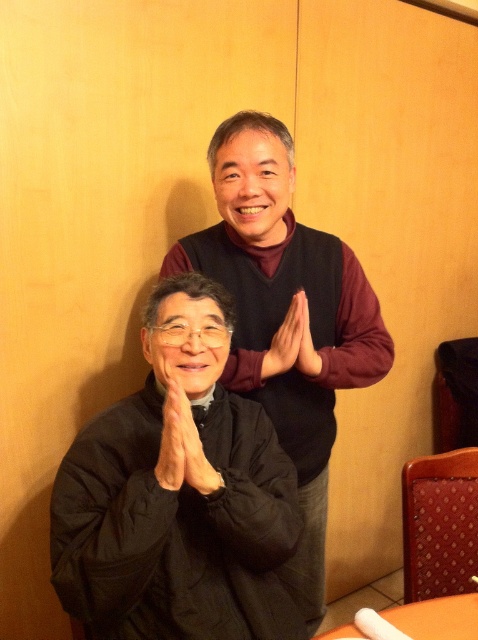
Question: Is black matte robe at lower left thinner than black matte jacket at center?

Choices:
 (A) yes
 (B) no

Answer: (A)

Question: Which object is positioned farthest from the matte black hands at center?

Choices:
 (A) orange plastic table at lower right
 (B) black matte jacket at center

Answer: (A)

Question: Is black matte jacket at center wider than orange plastic table at lower right?

Choices:
 (A) no
 (B) yes

Answer: (B)

Question: Which of these objects is positioned farthest from the black matte jacket at center?

Choices:
 (A) matte black hands at center
 (B) orange plastic table at lower right
 (C) black matte robe at lower left

Answer: (B)

Question: Which point is farther to the camera?

Choices:
 (A) (78, 484)
 (B) (364, 387)

Answer: (B)

Question: Does black matte jacket at center appear on the left side of orange plastic table at lower right?

Choices:
 (A) yes
 (B) no

Answer: (A)